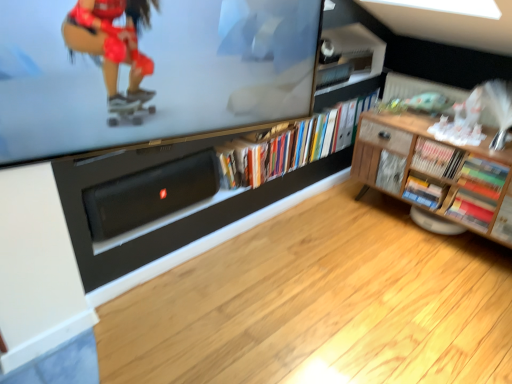
Question: Is wooden bookshelf at right, the third book when ordered from left to right, inside matte black television at upper center?

Choices:
 (A) yes
 (B) no

Answer: (B)

Question: From the image's perspective, is matte black television at upper center over wooden bookshelf at right, which appears as the third book when viewed from the right?

Choices:
 (A) yes
 (B) no

Answer: (A)

Question: Is matte black television at upper center oriented away from wooden bookshelf at right, the third book when ordered from left to right?

Choices:
 (A) no
 (B) yes

Answer: (A)

Question: Would you consider matte black television at upper center to be distant from wooden bookshelf at right, which appears as the third book when viewed from the right?

Choices:
 (A) yes
 (B) no

Answer: (A)

Question: From a real-world perspective, is matte black television at upper center located beneath wooden bookshelf at right, the third book when ordered from left to right?

Choices:
 (A) yes
 (B) no

Answer: (B)

Question: Would you say hardcover books at center, the fifth book positioned from the right, is inside or outside black matte speaker at lower center?

Choices:
 (A) inside
 (B) outside

Answer: (B)

Question: Relative to black matte speaker at lower center, is hardcover books at center, the fifth book positioned from the right, in front or behind?

Choices:
 (A) behind
 (B) front

Answer: (A)

Question: Is hardcover books at center, the fifth book positioned from the right, bigger or smaller than black matte speaker at lower center?

Choices:
 (A) big
 (B) small

Answer: (A)

Question: From a real-world perspective, is hardcover books at center, the fifth book positioned from the right, above or below black matte speaker at lower center?

Choices:
 (A) below
 (B) above

Answer: (A)

Question: Considering the positions of hardcover book at center-right, which is counted as the second book, starting from the left, and wooden cabinet at right in the image, is hardcover book at center-right, which is counted as the second book, starting from the left, taller or shorter than wooden cabinet at right?

Choices:
 (A) tall
 (B) short

Answer: (B)

Question: From the image's perspective, relative to wooden cabinet at right, is hardcover book at center-right, the fourth book when ordered from right to left, above or below?

Choices:
 (A) below
 (B) above

Answer: (A)

Question: Is hardcover book at center-right, the fourth book when ordered from right to left, in front of or behind wooden cabinet at right in the image?

Choices:
 (A) front
 (B) behind

Answer: (B)

Question: Looking at the image, does hardcover book at center-right, which is counted as the second book, starting from the left, seem bigger or smaller compared to wooden cabinet at right?

Choices:
 (A) small
 (B) big

Answer: (A)

Question: In the image, is hardcover book at center-right, the fourth book when ordered from right to left, positioned in front of or behind multicolored paper book at lower right, acting as the second book starting from the right?

Choices:
 (A) front
 (B) behind

Answer: (B)

Question: Considering the positions of hardcover book at center-right, which is counted as the second book, starting from the left, and multicolored paper book at lower right, acting as the second book starting from the right, in the image, is hardcover book at center-right, which is counted as the second book, starting from the left, taller or shorter than multicolored paper book at lower right, acting as the second book starting from the right,?

Choices:
 (A) tall
 (B) short

Answer: (A)